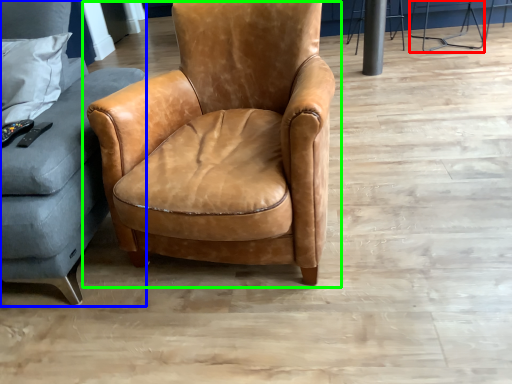
Question: Which object is the farthest from bar stool (highlighted by a red box)? Choose among these: studio couch (highlighted by a blue box) or chair (highlighted by a green box).

Choices:
 (A) studio couch
 (B) chair

Answer: (A)